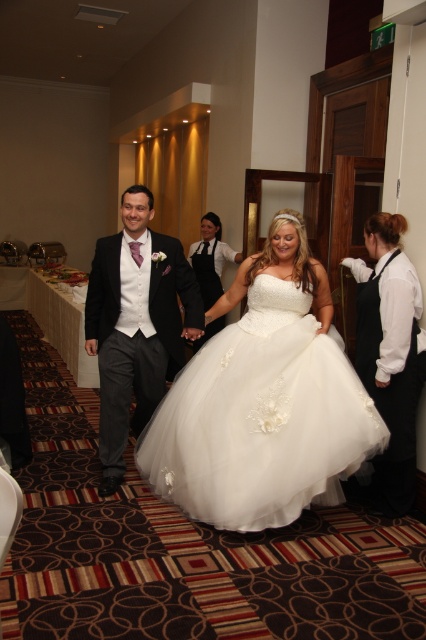
Is point (118, 308) closer to camera compared to point (218, 292)?

Yes, point (118, 308) is closer to viewer.

Between matte black suit at center and white satin dress at center, which one appears on the left side from the viewer's perspective?

matte black suit at center is more to the left.

Does point (137, 339) come closer to viewer compared to point (201, 248)?

That is True.

Image resolution: width=426 pixels, height=640 pixels. I want to click on matte black suit at center, so click(x=135, y=324).

Is point (322, 404) closer to viewer compared to point (207, 304)?

Yes, it is in front of point (207, 304).

Can you confirm if white tulle dress at center is bigger than white satin dress at center?

Indeed, white tulle dress at center has a larger size compared to white satin dress at center.

Is point (275, 449) positioned behind point (198, 266)?

No, (275, 449) is closer to viewer.

Identify the location of white tulle dress at center. (261, 419).

Which of these two, white satin dress at right or white satin dress at center, stands shorter?

With less height is white satin dress at center.

What do you see at coordinates (389, 355) in the screenshot?
I see `white satin dress at right` at bounding box center [389, 355].

In order to click on white satin dress at right in this screenshot , I will do `click(389, 355)`.

Where is `white satin dress at right`? white satin dress at right is located at coordinates (389, 355).